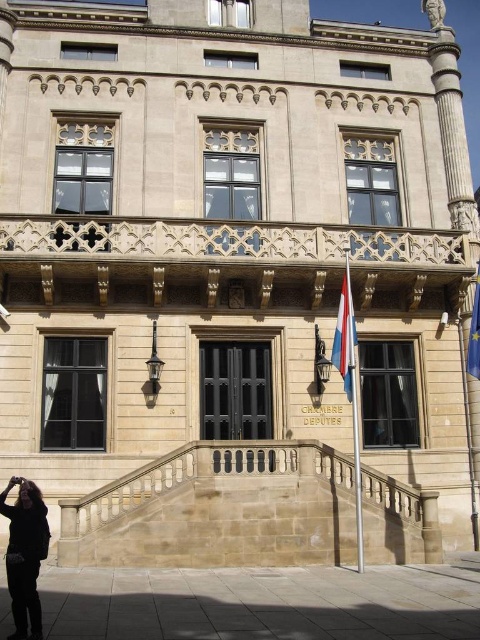
Question: Which of the following is the closest to the observer?

Choices:
 (A) beige stone balustrade at center
 (B) blue fabric flag at right
 (C) stone balustrade at center
 (D) polished fabric flag at center

Answer: (A)

Question: Does polished fabric flag at center appear over blue fabric flag at right?

Choices:
 (A) yes
 (B) no

Answer: (B)

Question: Is stone balustrade at center thinner than blue fabric flag at right?

Choices:
 (A) no
 (B) yes

Answer: (A)

Question: Is dark brown fur coat at lower left closer to the viewer compared to blue fabric flag at right?

Choices:
 (A) yes
 (B) no

Answer: (A)

Question: Which point appears closest to the camera in this image?

Choices:
 (A) coord(347,349)
 (B) coord(166,232)
 (C) coord(479,349)
 (D) coord(24,528)

Answer: (D)

Question: Considering the real-world distances, which object is farthest from the stone balustrade at center?

Choices:
 (A) blue fabric flag at right
 (B) beige stone balustrade at center
 (C) polished fabric flag at center
 (D) dark brown fur coat at lower left

Answer: (D)